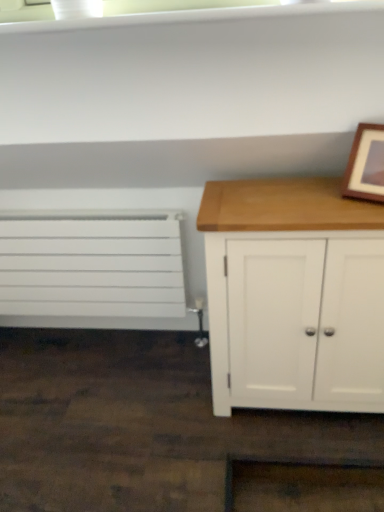
The height and width of the screenshot is (512, 384). What do you see at coordinates (294, 296) in the screenshot?
I see `white wood cabinet at right` at bounding box center [294, 296].

The height and width of the screenshot is (512, 384). Find the location of `wooden picture frame at upper right`. wooden picture frame at upper right is located at coordinates (x=366, y=164).

Is wooden picture frame at upper right located outside white matte radiator at left?

wooden picture frame at upper right is positioned outside white matte radiator at left.

Considering the relative positions of wooden picture frame at upper right and white matte radiator at left in the image provided, is wooden picture frame at upper right to the left of white matte radiator at left from the viewer's perspective?

No.

How distant is wooden picture frame at upper right from white matte radiator at left?

wooden picture frame at upper right is 37.63 inches away from white matte radiator at left.

Considering the positions of point (344, 194) and point (34, 283), is point (344, 194) closer or farther from the camera than point (34, 283)?

Point (344, 194) is positioned closer to the camera compared to point (34, 283).

From the image's perspective, which one is positioned lower, white wood cabinet at right or white matte radiator at left?

From the image's view, white wood cabinet at right is below.

From a real-world perspective, is white wood cabinet at right on top of white matte radiator at left?

Indeed, from a real-world perspective, white wood cabinet at right stands above white matte radiator at left.

Does white wood cabinet at right have a lesser width compared to white matte radiator at left?

In fact, white wood cabinet at right might be wider than white matte radiator at left.

Which of these two, white wood cabinet at right or white matte radiator at left, is smaller?

Smaller between the two is white matte radiator at left.

From the image's perspective, is white wood cabinet at right under wooden picture frame at upper right?

Correct, white wood cabinet at right appears lower than wooden picture frame at upper right in the image.

Between white wood cabinet at right and wooden picture frame at upper right, which one has smaller width?

Thinner between the two is wooden picture frame at upper right.

Is white wood cabinet at right oriented towards wooden picture frame at upper right?

No, white wood cabinet at right is not facing towards wooden picture frame at upper right.

Which is further, (258, 260) or (374, 183)?

Positioned behind is point (374, 183).

Which object is closer to the camera, white matte radiator at left or white wood cabinet at right?

white wood cabinet at right is more forward.

Between white matte radiator at left and white wood cabinet at right, which one appears on the right side from the viewer's perspective?

From the viewer's perspective, white wood cabinet at right appears more on the right side.

Can you tell me how much white matte radiator at left and white wood cabinet at right differ in facing direction?

There is a 0.757-degree angle between the facing directions of white matte radiator at left and white wood cabinet at right.

Does white matte radiator at left have a larger size compared to white wood cabinet at right?

No, white matte radiator at left is not bigger than white wood cabinet at right.

Consider the image. Could you tell me if white matte radiator at left is facing wooden picture frame at upper right?

No, white matte radiator at left does not turn towards wooden picture frame at upper right.

Is white matte radiator at left further to camera compared to wooden picture frame at upper right?

Yes, it is.

Would you say white matte radiator at left is inside or outside wooden picture frame at upper right?

white matte radiator at left is not inside wooden picture frame at upper right, it's outside.

Locate an element on the screen. This screenshot has height=512, width=384. picture frame lying above the white matte radiator at left (from the image's perspective) is located at coordinates (366, 164).

What's the angular difference between wooden picture frame at upper right and white wood cabinet at right's facing directions?

There is a 31.2-degree angle between the facing directions of wooden picture frame at upper right and white wood cabinet at right.

Is the surface of wooden picture frame at upper right in direct contact with white wood cabinet at right?

wooden picture frame at upper right and white wood cabinet at right are not in contact.

Considering the points (362, 178) and (309, 183), which point is in front, point (362, 178) or point (309, 183)?

Point (362, 178)

Which is in front, wooden picture frame at upper right or white wood cabinet at right?

wooden picture frame at upper right is closer to the camera.

Where is `drawer on the left of wooden picture frame at upper right`? drawer on the left of wooden picture frame at upper right is located at coordinates (91, 265).

The width and height of the screenshot is (384, 512). I want to click on the chest of drawers located below the white matte radiator at left (from the image's perspective), so coord(294,296).

Which object lies nearer to the anchor point white wood cabinet at right, wooden picture frame at upper right or white matte radiator at left?

Based on the image, wooden picture frame at upper right appears to be nearer to white wood cabinet at right.

Based on their spatial positions, is wooden picture frame at upper right or white wood cabinet at right closer to white matte radiator at left?

white wood cabinet at right lies closer to white matte radiator at left than the other object.

Based on their spatial positions, is white matte radiator at left or white wood cabinet at right closer to wooden picture frame at upper right?

white wood cabinet at right is closer to wooden picture frame at upper right.

Looking at the image, which one is located further to white wood cabinet at right, white matte radiator at left or wooden picture frame at upper right?

white matte radiator at left.

Estimate the real-world distances between objects in this image. Which object is closer to wooden picture frame at upper right, white wood cabinet at right or white matte radiator at left?

white wood cabinet at right is closer to wooden picture frame at upper right.

From the picture: Looking at the image, which one is located further to white matte radiator at left, white wood cabinet at right or wooden picture frame at upper right?

Based on the image, wooden picture frame at upper right appears to be further to white matte radiator at left.

Image resolution: width=384 pixels, height=512 pixels. Identify the location of chest of drawers between white matte radiator at left and wooden picture frame at upper right. (294, 296).